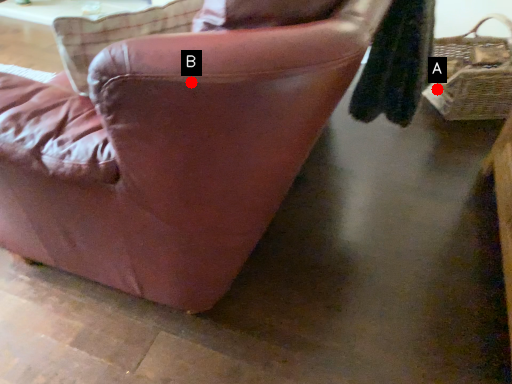
Question: Two points are circled on the image, labeled by A and B beside each circle. Among these points, which one is farthest from the camera?

Choices:
 (A) A is further
 (B) B is further

Answer: (A)